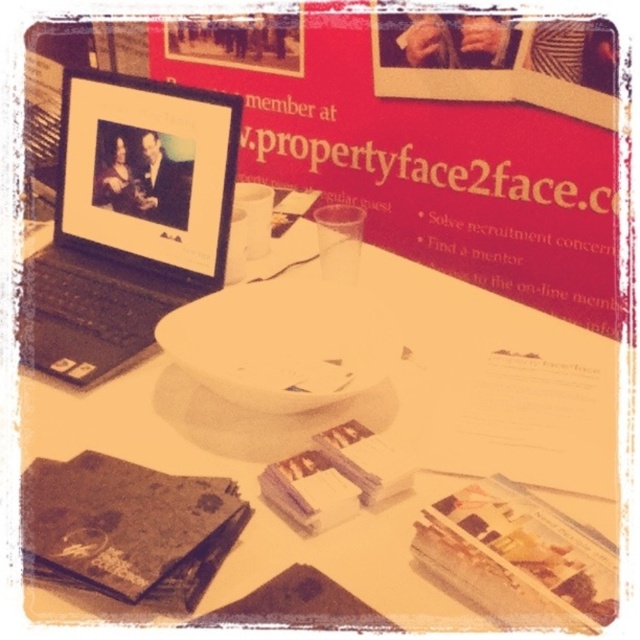
Does point (323, 522) come in front of point (104, 499)?

No, it is not.

Who is lower down, white glossy plate at upper center or dark brown textured book at lower left?

dark brown textured book at lower left

Find the location of a particular element. This screenshot has height=640, width=640. white glossy plate at upper center is located at coordinates (344, 429).

Measure the distance between white glossy plate at upper center and camera.

white glossy plate at upper center is 16.15 inches from camera.

Between point (216, 388) and point (588, 84), which one is positioned in front?

Positioned in front is point (216, 388).

Image resolution: width=640 pixels, height=640 pixels. I want to click on white glossy plate at upper center, so click(x=344, y=429).

Who is positioned more to the right, matte black laptop at left or matte paper book at center?

Positioned to the right is matte paper book at center.

Is matte black laptop at left below matte paper book at center?

Actually, matte black laptop at left is above matte paper book at center.

What do you see at coordinates (128, 220) in the screenshot?
I see `matte black laptop at left` at bounding box center [128, 220].

I want to click on matte black laptop at left, so click(x=128, y=220).